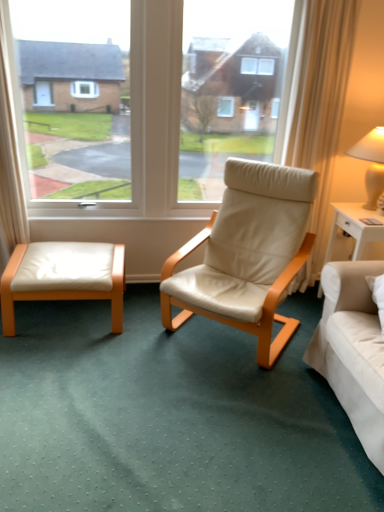
Question: Would you say matte beige lampshade at upper right is to the left or to the right of white leather ottoman at lower left in the picture?

Choices:
 (A) right
 (B) left

Answer: (A)

Question: Considering the positions of matte beige lampshade at upper right and white leather ottoman at lower left in the image, is matte beige lampshade at upper right taller or shorter than white leather ottoman at lower left?

Choices:
 (A) short
 (B) tall

Answer: (B)

Question: Which object is positioned farthest from the beige leather chair at center?

Choices:
 (A) matte beige lampshade at upper right
 (B) white leather ottoman at lower left
 (C) white glossy nightstand at right

Answer: (A)

Question: Based on their relative distances, which object is nearer to the beige leather chair at center?

Choices:
 (A) white glossy nightstand at right
 (B) matte beige lampshade at upper right
 (C) white leather ottoman at lower left

Answer: (A)